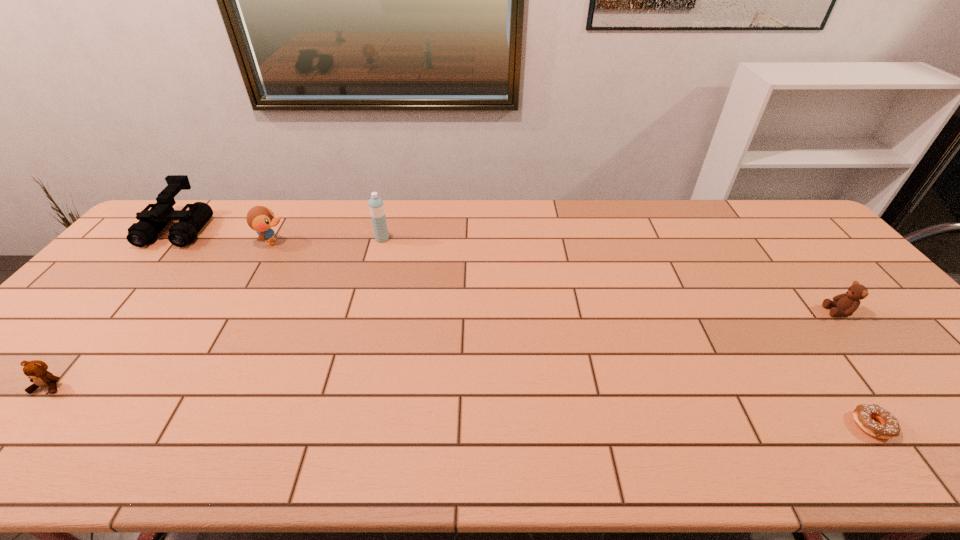
The image size is (960, 540). Find the location of `the third object from right to left`. the third object from right to left is located at coordinates (376, 206).

Locate an element on the screen. Image resolution: width=960 pixels, height=540 pixels. the tallest object is located at coordinates (376, 206).

I want to click on binoculars, so click(x=151, y=222).

The height and width of the screenshot is (540, 960). I want to click on duck, so click(259, 218).

I want to click on the third nearest object, so click(x=845, y=304).

Where is `the right teddy bear`? Image resolution: width=960 pixels, height=540 pixels. the right teddy bear is located at coordinates (845, 304).

The width and height of the screenshot is (960, 540). I want to click on the left teddy bear, so click(36, 370).

You are a GUI agent. You are given a task and a screenshot of the screen. Output one action in this format:
    pyautogui.click(x=<x>, y=<y>)
    Task: Click on the fifth farthest object
    The image size is (960, 540).
    Given the screenshot: What is the action you would take?
    pyautogui.click(x=36, y=370)

Where is `the nearest object`? the nearest object is located at coordinates (889, 427).

The width and height of the screenshot is (960, 540). Find the location of `the shortest object`. the shortest object is located at coordinates (889, 427).